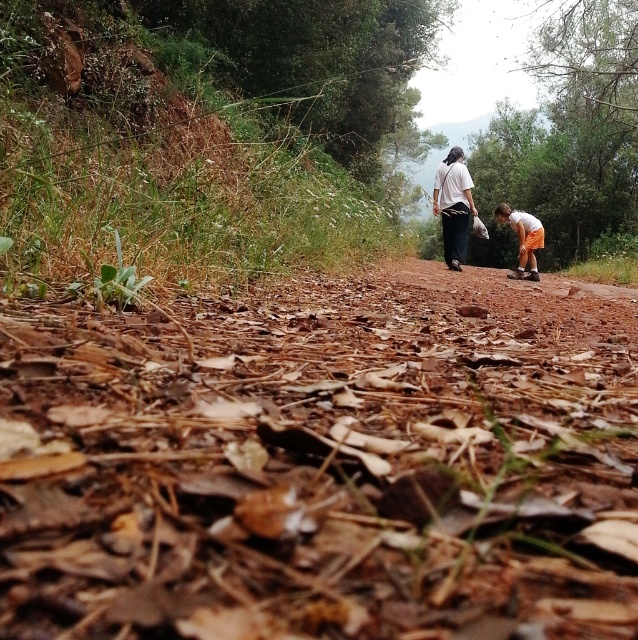
Which is in front, point (627, 550) or point (517, 211)?

Point (627, 550)

Does point (308, 324) lie in front of point (533, 273)?

Yes.

Is point (1, 561) less distant than point (526, 275)?

Yes.

Find the location of `brown dry leaves at center`. brown dry leaves at center is located at coordinates (323, 460).

The image size is (638, 640). What do you see at coordinates (454, 205) in the screenshot?
I see `white cotton shirt at upper center` at bounding box center [454, 205].

Which is above, white cotton shirt at upper center or orange cotton shorts at lower right?

white cotton shirt at upper center

The width and height of the screenshot is (638, 640). I want to click on white cotton shirt at upper center, so click(x=454, y=205).

Who is taller, brown dry leaves at center or white cotton shirt at upper center?

white cotton shirt at upper center is taller.

Locate an element on the screen. The width and height of the screenshot is (638, 640). brown dry leaves at center is located at coordinates (323, 460).

Where is `brown dry leaves at center`? brown dry leaves at center is located at coordinates point(323,460).